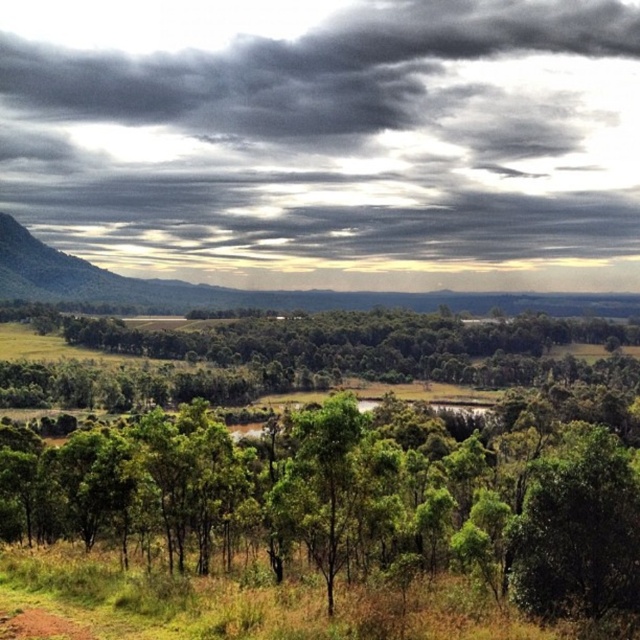
Please look at the point at coordinate (323, 132). What is the color of the object located at that point?

The point at coordinate (323, 132) is on a dark gray cloud at upper center.

You are a weather balloon operator who needs to launch a balloon that can travel 500 meters. You see the dark gray cloud at upper center. Can your balloon reach it?

The dark gray cloud at upper center is 487.82 meters away, so yes, the balloon can reach it as it is within the 500 meters range.

You are an artist planning to paint this landscape. You want to emphasize the dark gray cloud at upper center and the green leafy trees at center in your painting. Which object should you make larger in your artwork to show their importance?

You should make the dark gray cloud at upper center larger than the green leafy trees at center in your artwork because the dark gray cloud at upper center has a larger size compared to green leafy trees at center.